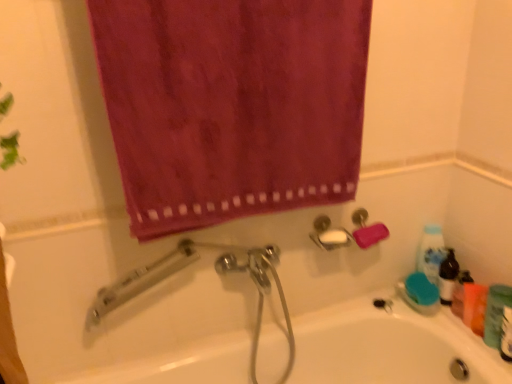
At what (x,y) coordinates should I click in order to perform the action: click on free spot in front of orange matte bottle at right, marked as the first mouthwash in a left-to-right arrangement. Please return your answer as a coordinate pair (x, y). Image resolution: width=512 pixels, height=384 pixels. Looking at the image, I should click on (482, 357).